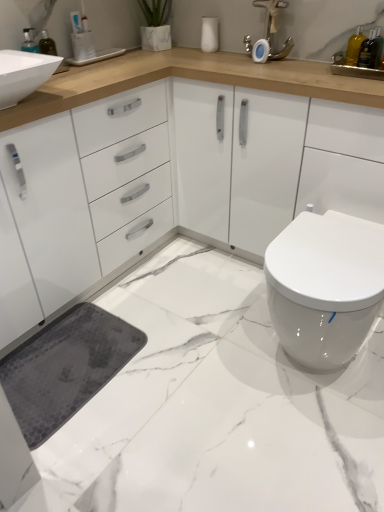
Where is `free space that is to the left of white glossy toilet at lower right`? The width and height of the screenshot is (384, 512). free space that is to the left of white glossy toilet at lower right is located at coordinates (213, 350).